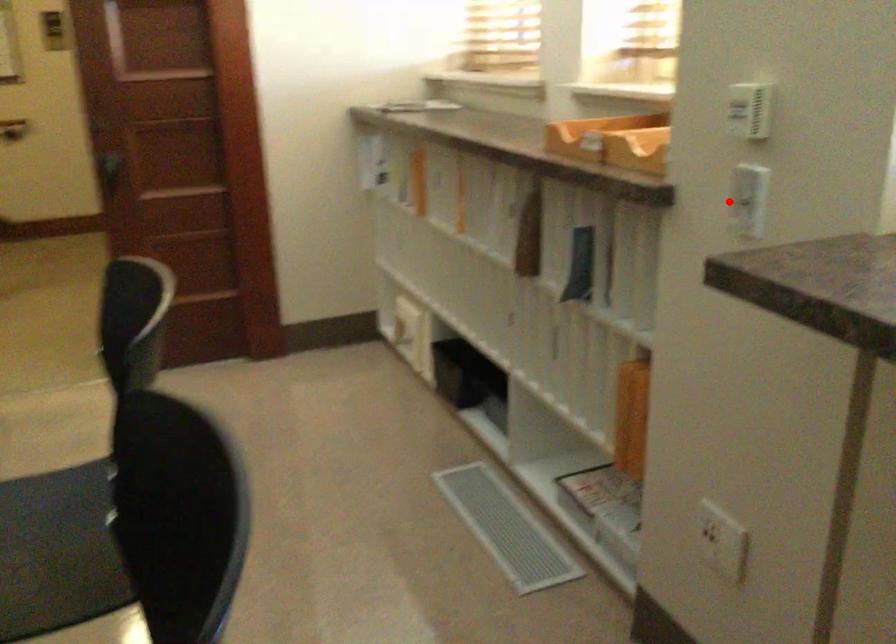
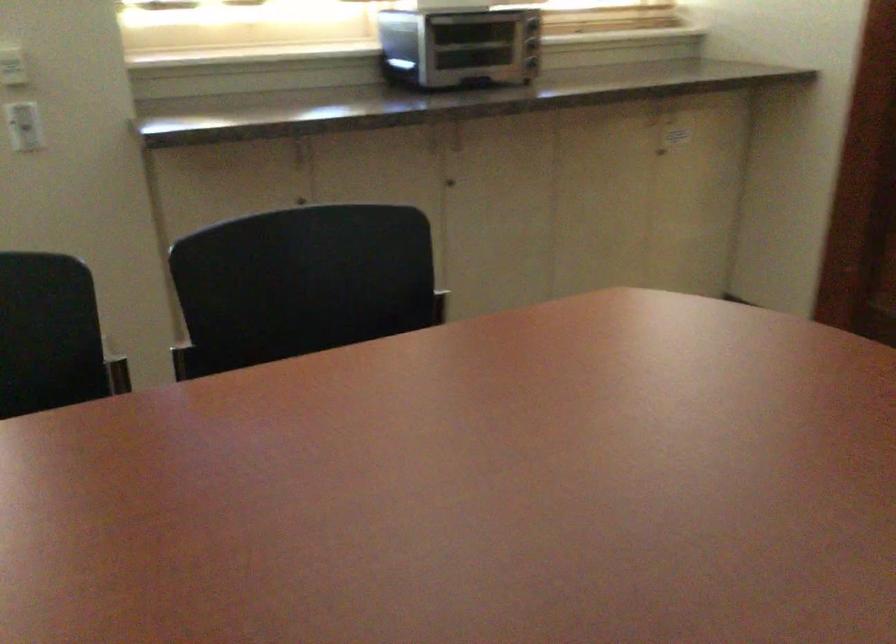
Question: I am providing you with two images of the same scene from different viewpoints. In image1, a red point is highlighted. Considering the same 3D point in image2, which of the following is correct?

Choices:
 (A) It is closer
 (B) It is farther

Answer: (B)